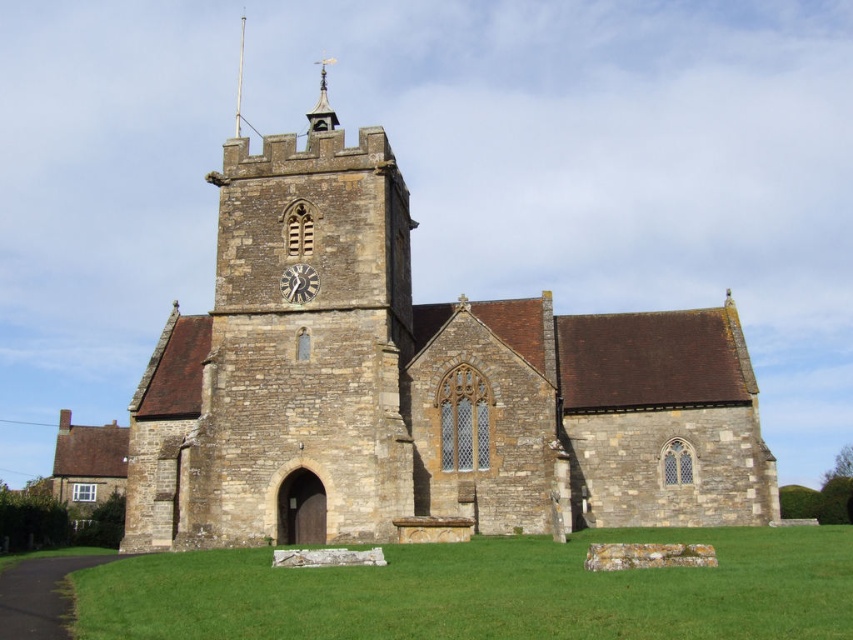
Question: Can you confirm if green grass at center is bigger than stone spire at upper center?

Choices:
 (A) no
 (B) yes

Answer: (A)

Question: Which point is closer to the camera?

Choices:
 (A) (210, 314)
 (B) (317, 129)

Answer: (A)

Question: Which of the following is the farthest from the observer?

Choices:
 (A) brown stone church at center
 (B) green grass at center

Answer: (A)

Question: In this image, where is green grass at center located relative to dark gray stone clock at center?

Choices:
 (A) below
 (B) above

Answer: (A)

Question: Observing the image, what is the correct spatial positioning of brown stone church at center in reference to dark gray stone clock at center?

Choices:
 (A) below
 (B) above

Answer: (B)

Question: Which point is closer to the camera?

Choices:
 (A) dark gray stone clock at center
 (B) smooth silver spire at upper center
 (C) stone spire at upper center
 (D) brown stone church at center

Answer: (D)